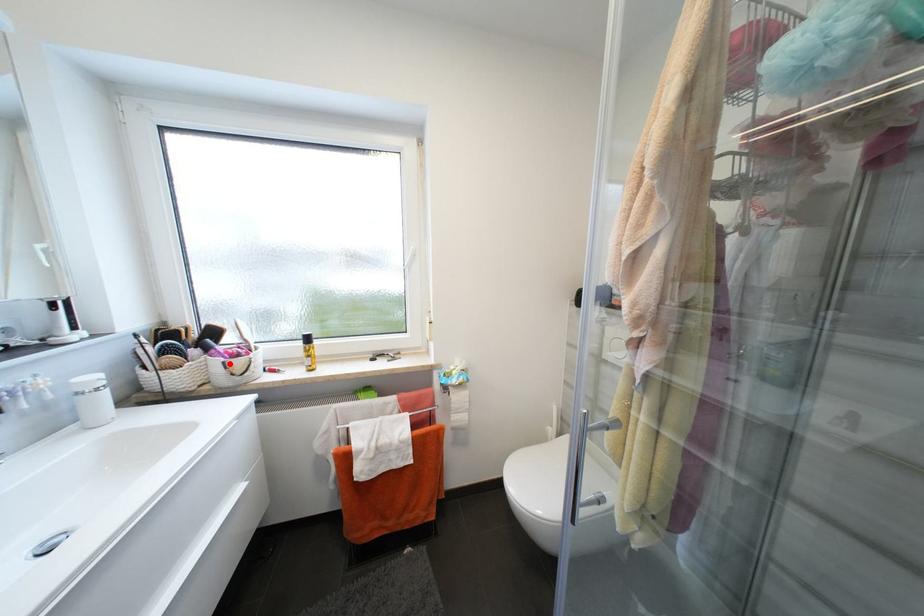
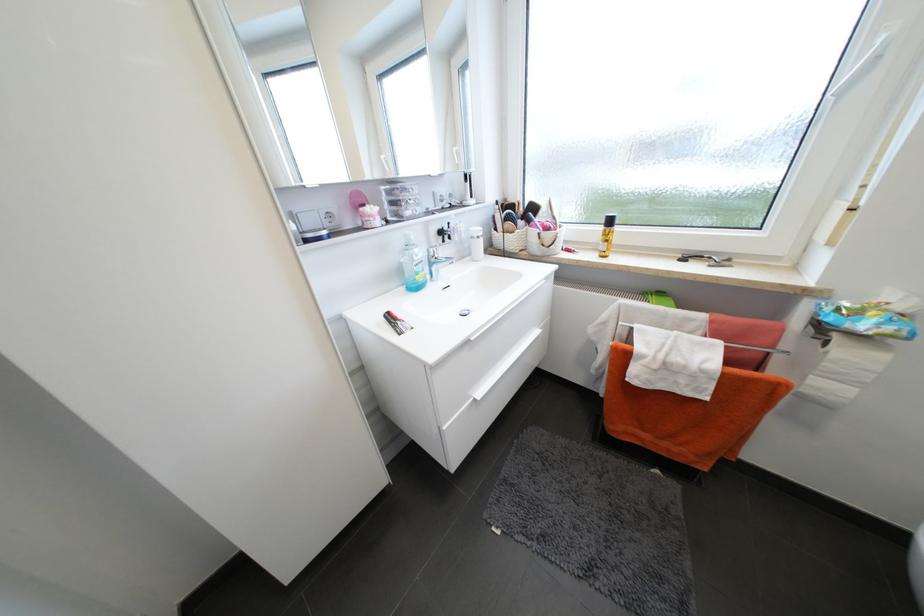
Find the pixel in the second image that matches the highlighted location in the first image.

(544, 235)